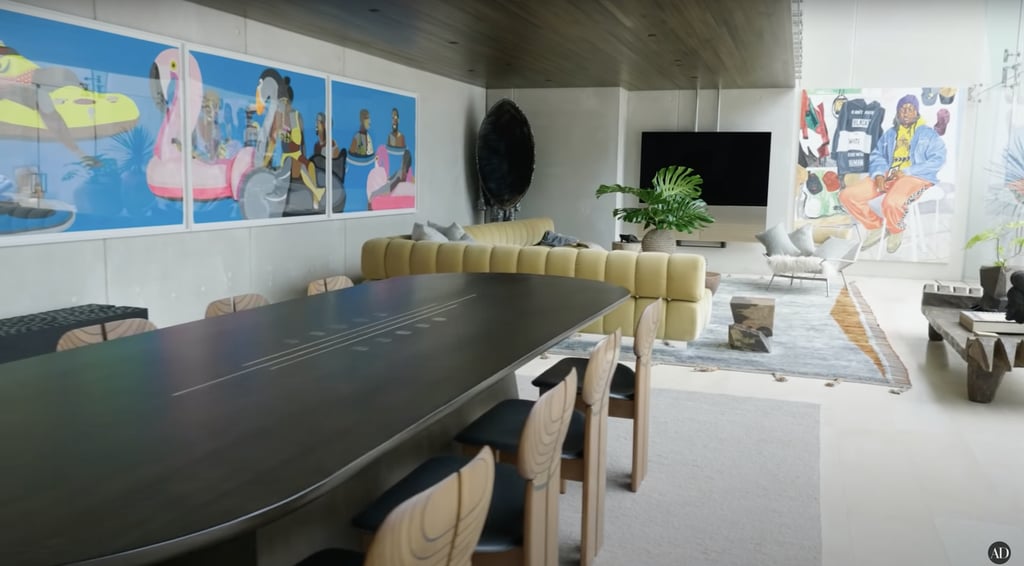
The image size is (1024, 566). What are the coordinates of `house plants` in the screenshot? It's located at (992, 273), (655, 228).